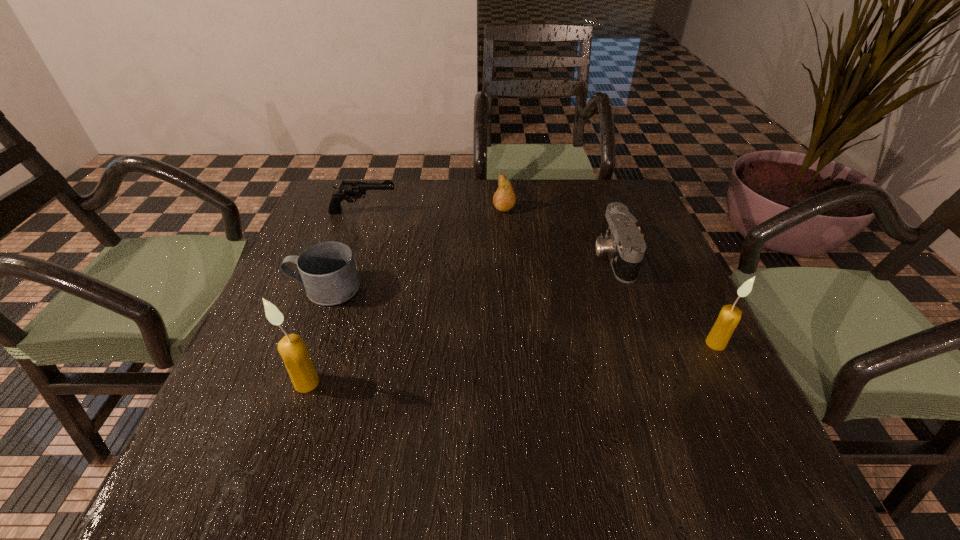
The width and height of the screenshot is (960, 540). In order to click on vacant space that satisfies the following two spatial constraints: 1. at the end of the barrel of the gun; 2. on the back side of the second tallest object in this screenshot , I will do `click(318, 343)`.

Locate an element on the screen. vacant position in the image that satisfies the following two spatial constraints: 1. on the lens of the camera; 2. on the right side of the shorter candle is located at coordinates (644, 343).

Identify the location of vacant point that satisfies the following two spatial constraints: 1. on the side of the mug with the handle; 2. on the right side of the right candle. (304, 343).

Find the location of a particular element. The image size is (960, 540). free spot that satisfies the following two spatial constraints: 1. at the end of the barrel of the shorter candle; 2. on the right side of the gun is located at coordinates (318, 343).